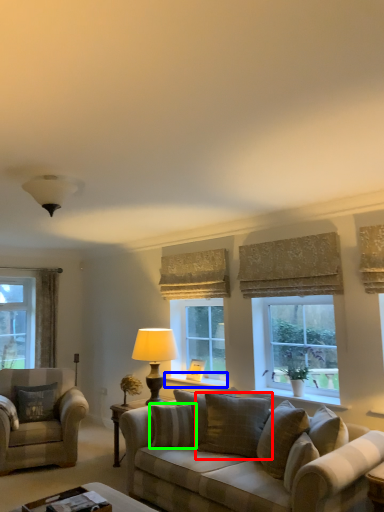
Question: Which object is the closest to the pillow (highlighted by a red box)? Choose among these: window sill (highlighted by a blue box) or pillow (highlighted by a green box).

Choices:
 (A) window sill
 (B) pillow

Answer: (B)